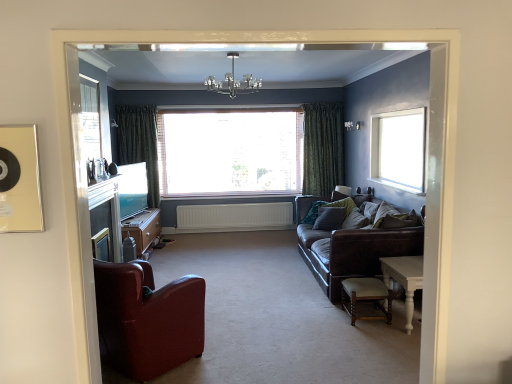
Where is `free location to the left of light beige leather stool at lower right`? This screenshot has height=384, width=512. free location to the left of light beige leather stool at lower right is located at coordinates (327, 321).